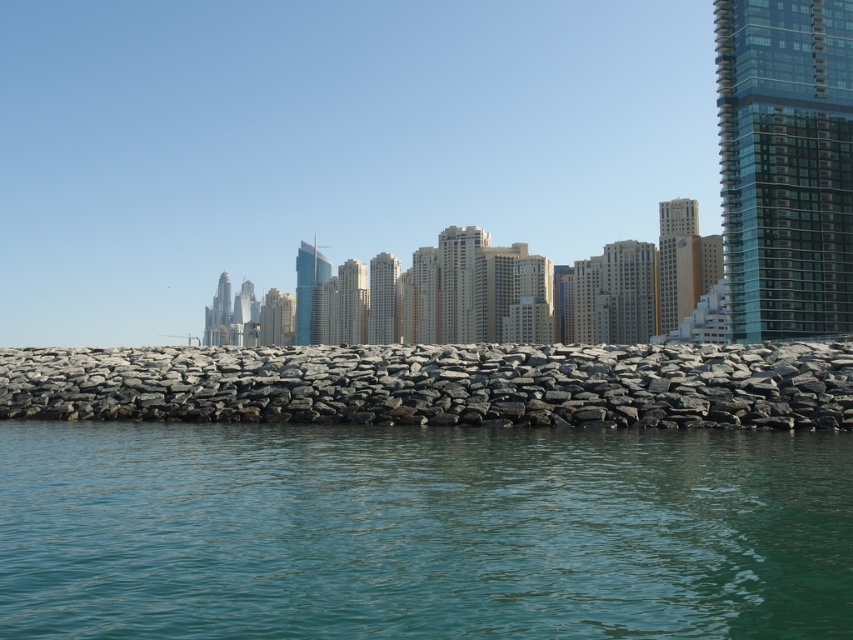
From the picture: You are standing on the gray rock wall at center and want to see the clear water at center. In which direction should you look?

You should look to your right to see the clear water at center, since it is located to the right of the gray rock wall at center.

You are a boat captain navigating through the waterfront scene. You need to pass between the clear water at center and the gray rock wall at center. Can your boat, which is 10 meters wide, safely navigate through this passage?

The clear water at center is narrower than the gray rock wall at center. Since the boat is 10 meters wide, it cannot safely navigate through the passage as the water is too narrow.